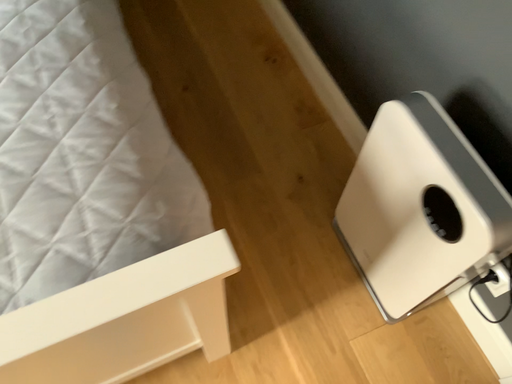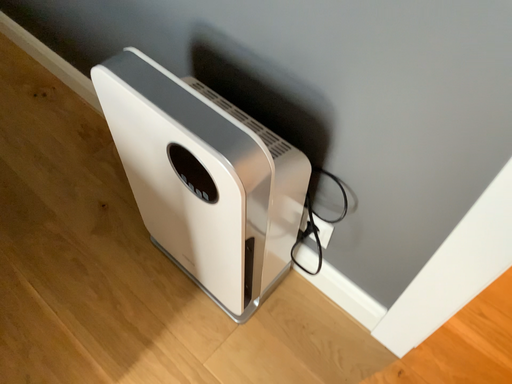
Question: How did the camera likely rotate when shooting the video?

Choices:
 (A) rotated downward
 (B) rotated upward

Answer: (B)